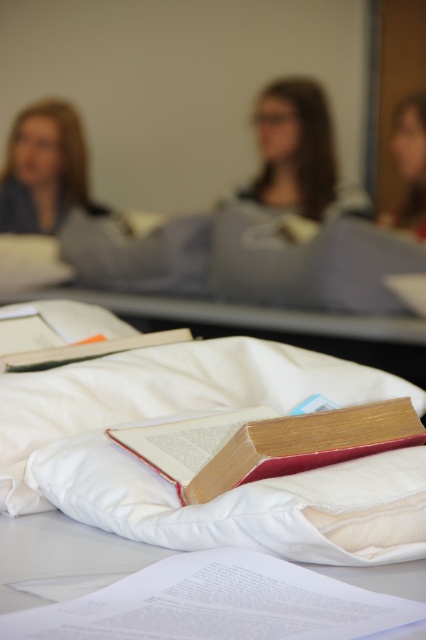
You are standing in the classroom depicted in the image and want to place a small object on the white fabric at lower center. What are the coordinates where you should place it?

The coordinates for the white fabric at lower center are at point [62,557], so you should place the object there.

You are a student sitting at a desk in the classroom. You notice the white fabric at lower center and the matte blue shirt at left. Which object is closer to you?

The white fabric at lower center is closer to you because it is in front of the matte blue shirt at left.

Consider the image. You are a student in the classroom and want to know which clothing item is taller between the matte gray sweater at center and the matte blue shirt at left. Can you determine this based on their positions?

The matte gray sweater at center is much taller than the matte blue shirt at left, so it is the taller clothing item.